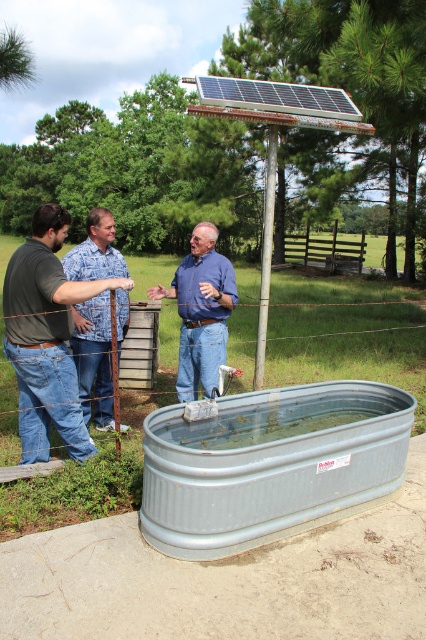
You are a farmer checking the water levels in the galvanized metal tub at lower center and the brushed metal water tank at lower center. Which container has a higher height?

The galvanized metal tub at lower center has a greater height compared to the brushed metal water tank at lower center.

You are a painter who needs to store your brushes and supplies. You see the galvanized metal tub at lower center and the matte black shirt at center. Which object can you use to store your items, and why?

The galvanized metal tub at lower center can be used to store brushes and supplies because it has a larger capacity than the matte black shirt at center, which is smaller in size and not designed for storage.